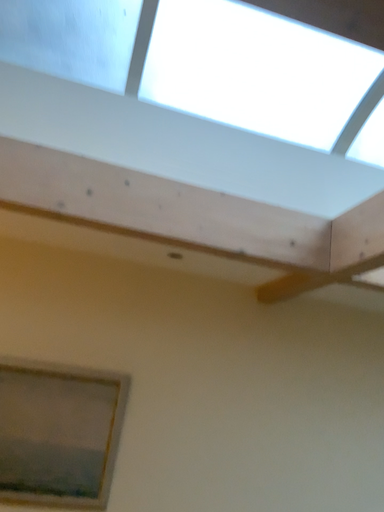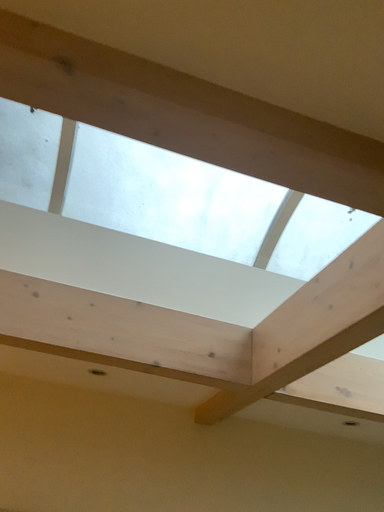
Question: How did the camera likely rotate when shooting the video?

Choices:
 (A) rotated upward
 (B) rotated downward

Answer: (A)